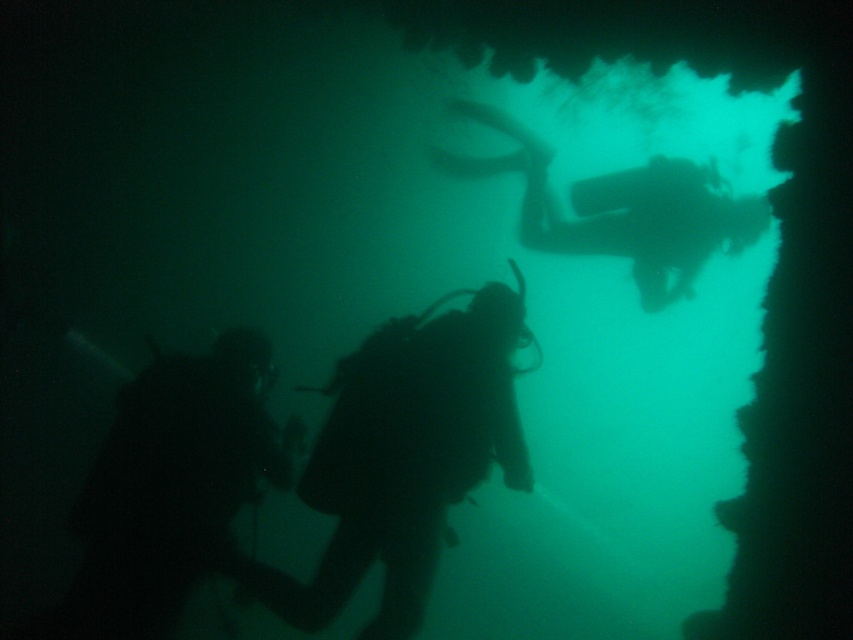
Question: Which of the following is the farthest from the observer?

Choices:
 (A) (410, 358)
 (B) (119, 454)

Answer: (B)

Question: Which point is closer to the camera?

Choices:
 (A) (328, 436)
 (B) (120, 572)

Answer: (A)

Question: Which point is farther to the camera?

Choices:
 (A) (254, 336)
 (B) (498, 410)

Answer: (A)

Question: Is black matte scuba diver at center to the left of black matte scuba diver at lower left from the viewer's perspective?

Choices:
 (A) no
 (B) yes

Answer: (A)

Question: Can you confirm if black matte scuba diver at center is positioned above black matte scuba diver at lower left?

Choices:
 (A) no
 (B) yes

Answer: (B)

Question: Does black matte scuba diver at center have a lesser width compared to black matte scuba diver at lower left?

Choices:
 (A) no
 (B) yes

Answer: (A)